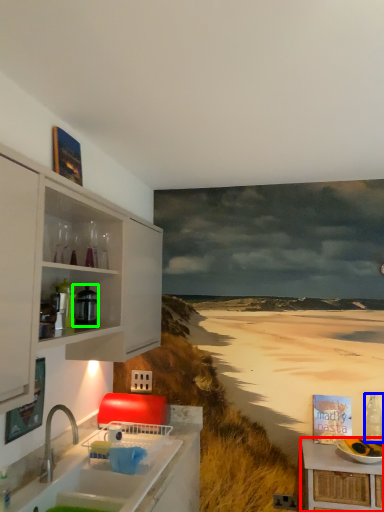
Question: Which object is positioned closest to table (highlighted by a red box)? Select from bottle (highlighted by a blue box) and appliance (highlighted by a green box).

Choices:
 (A) bottle
 (B) appliance

Answer: (A)